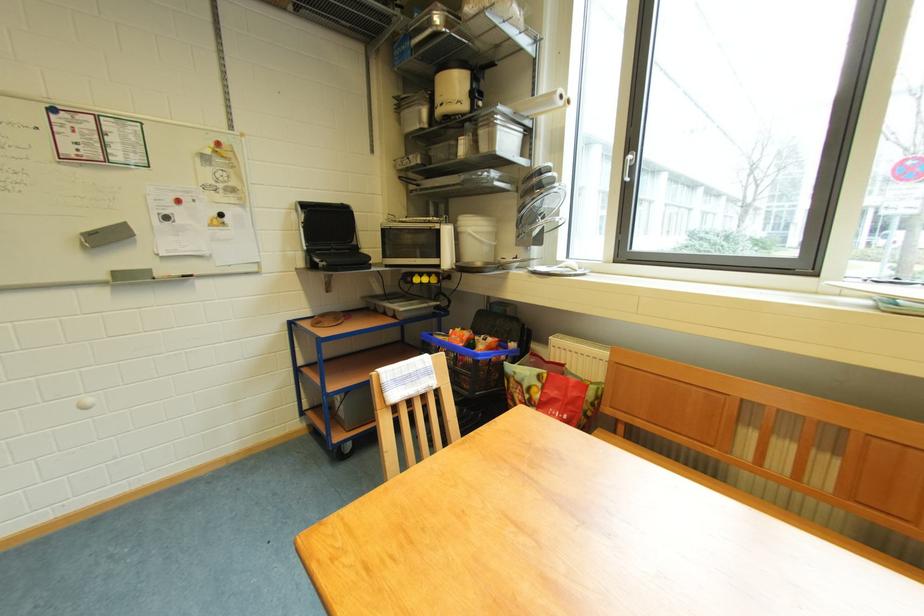
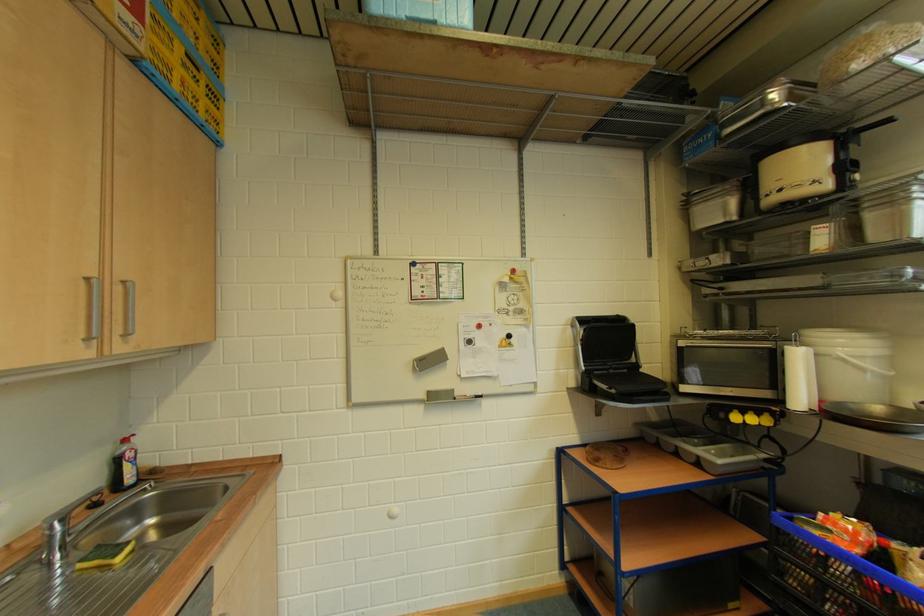
In the second image, find the point that corresponds to point (484, 341) in the first image.

(905, 549)